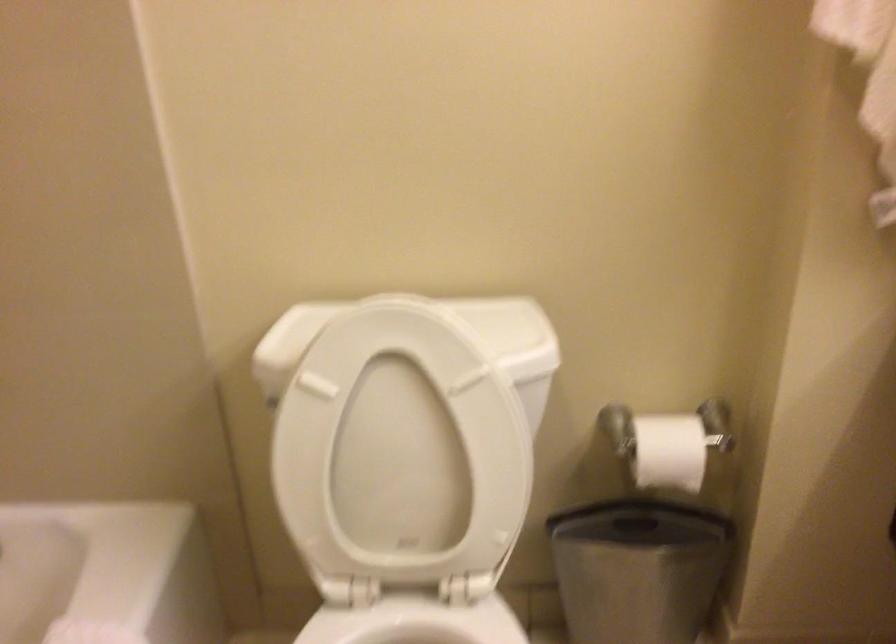
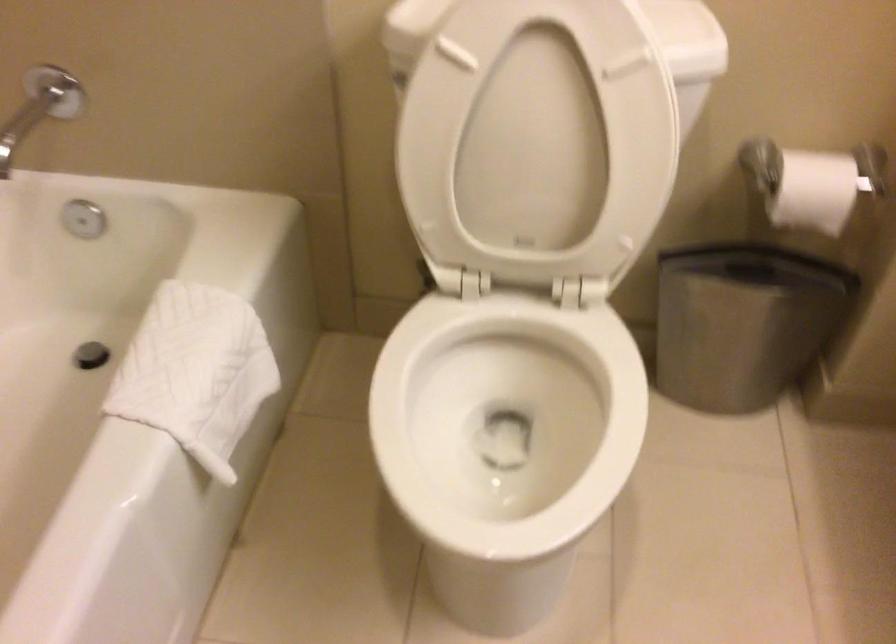
In the second image, find the point that corresponds to point 407,456 in the first image.

(538, 140)